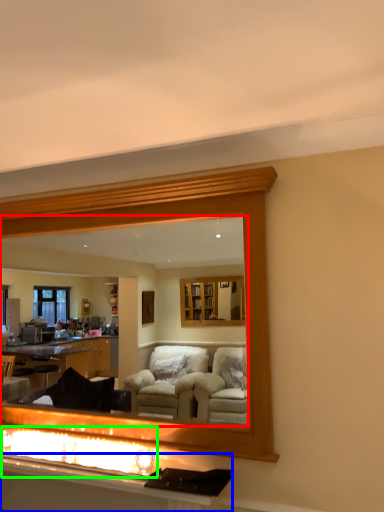
Question: Which object is the closest to the mirror (highlighted by a red box)? Choose among these: vanity (highlighted by a blue box) or reflection (highlighted by a green box).

Choices:
 (A) vanity
 (B) reflection

Answer: (B)